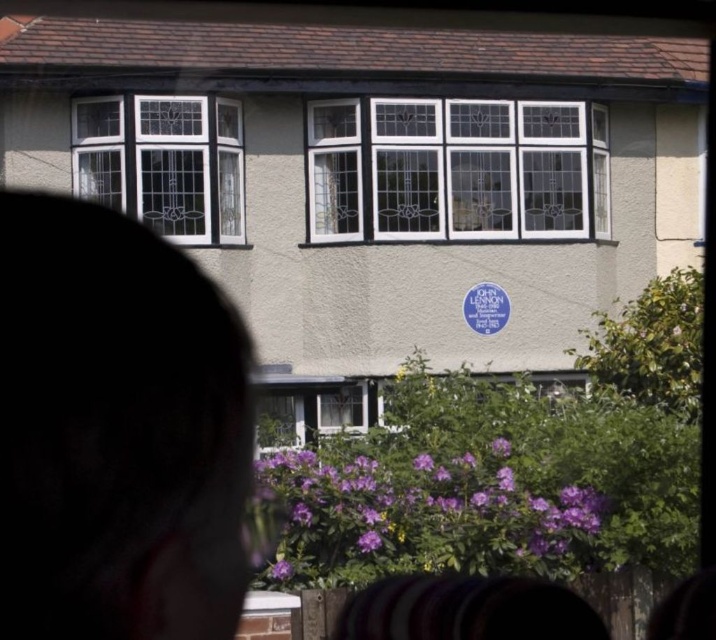
Question: Among these objects, which one is farthest from the camera?

Choices:
 (A) white glass window at left
 (B) silhouette hair at center

Answer: (A)

Question: Observing the image, what is the correct spatial positioning of silhouette hair at center in reference to clear glass windows at center?

Choices:
 (A) below
 (B) above

Answer: (A)

Question: Does silhouette hair at center appear under clear glass windows at center?

Choices:
 (A) yes
 (B) no

Answer: (A)

Question: Which is farther from the clear glass windows at center?

Choices:
 (A) silhouette hair at center
 (B) white glass window at left

Answer: (A)

Question: Does clear glass windows at center come behind white glass window at left?

Choices:
 (A) no
 (B) yes

Answer: (B)

Question: Which object is the farthest from the silhouette hair at center?

Choices:
 (A) clear glass windows at center
 (B) white glass window at left

Answer: (A)